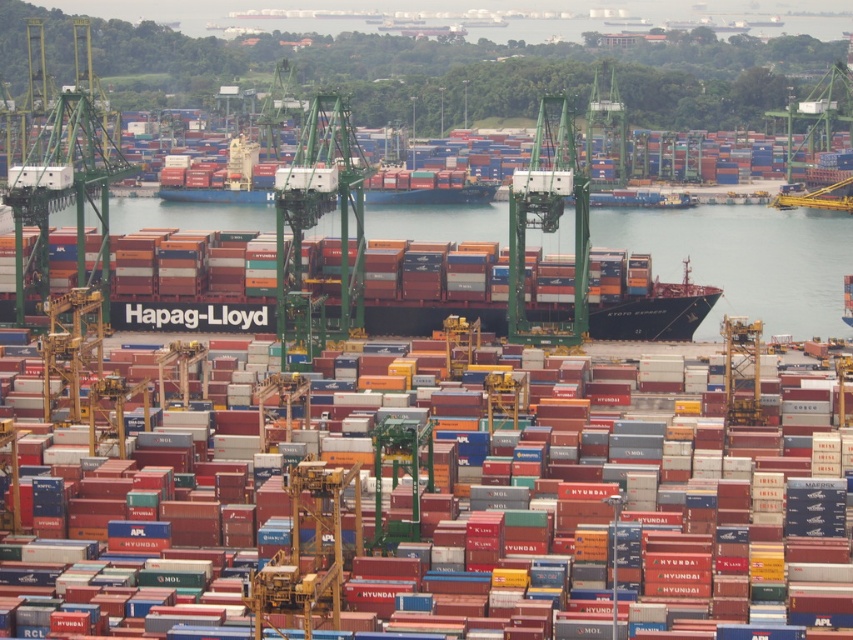
Question: Which point is closer to the camera taking this photo?

Choices:
 (A) (659, 275)
 (B) (769, 456)

Answer: (A)

Question: Which point is closer to the camera taking this photo?

Choices:
 (A) (813, 612)
 (B) (668, 236)

Answer: (B)

Question: Which object appears closest to the camera in this image?

Choices:
 (A) transparent water at center
 (B) metallic gray container at center

Answer: (A)

Question: Is transparent water at center thinner than metallic gray container at center?

Choices:
 (A) no
 (B) yes

Answer: (A)

Question: Does transparent water at center appear over metallic gray container at center?

Choices:
 (A) no
 (B) yes

Answer: (B)

Question: Is transparent water at center further to the viewer compared to metallic gray container at center?

Choices:
 (A) no
 (B) yes

Answer: (A)